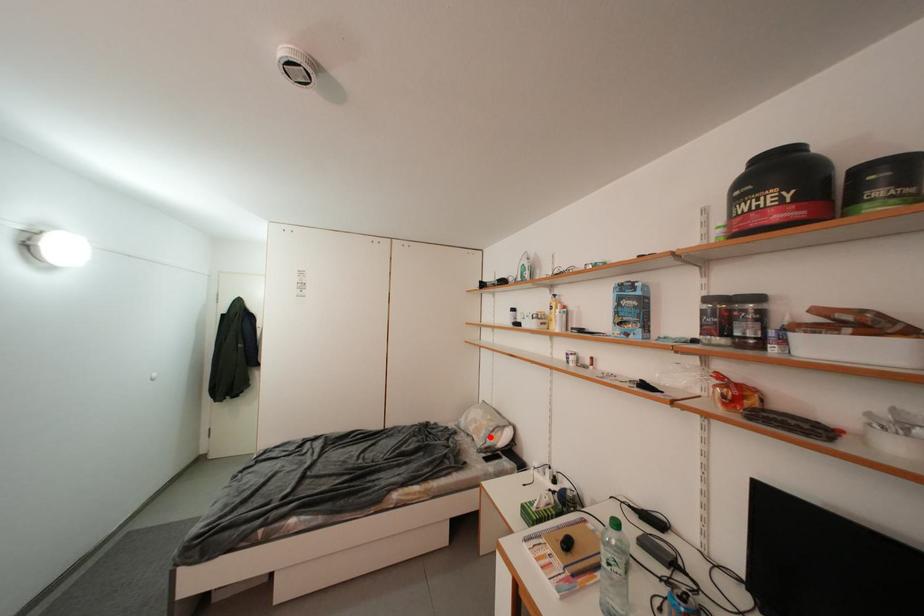
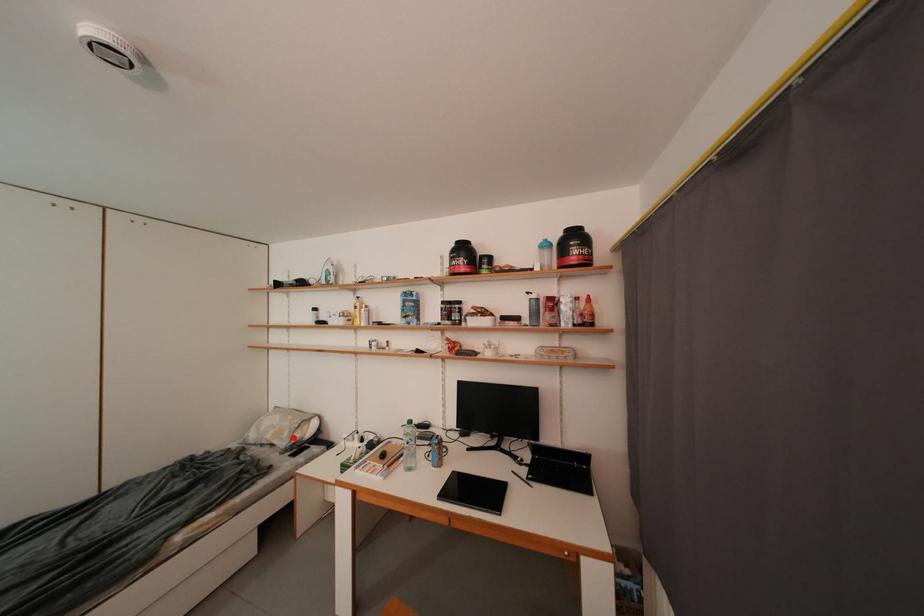
I am providing you with two images of the same scene from different viewpoints. A red point is marked on the first image and another point is marked on the second image. Is the red point in image1 aligned with the point shown in image2?

Yes